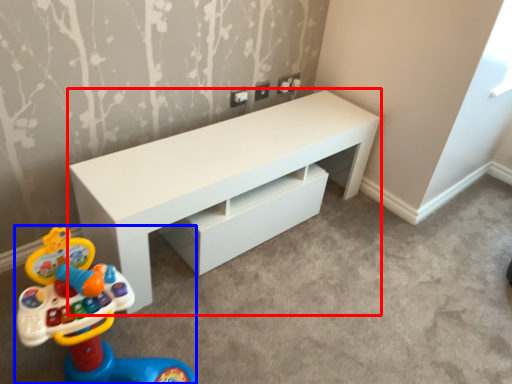
Question: Among these objects, which one is nearest to the camera, table (highlighted by a red box) or toy (highlighted by a blue box)?

Choices:
 (A) table
 (B) toy

Answer: (B)